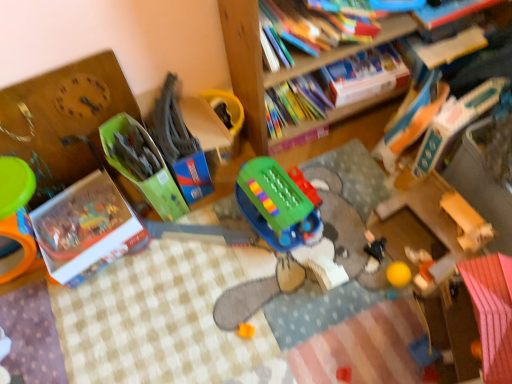
Question: Considering the relative sizes of hardcover book at upper right, which is the fourth book in left-to-right order, and hardcover book at upper right, the fourth book positioned from the right, in the image provided, is hardcover book at upper right, which is the fourth book in left-to-right order, taller than hardcover book at upper right, the fourth book positioned from the right,?

Choices:
 (A) yes
 (B) no

Answer: (B)

Question: From the image's perspective, is hardcover book at upper right, the second book when ordered from right to left, over hardcover book at upper right, the fourth book positioned from the right?

Choices:
 (A) no
 (B) yes

Answer: (B)

Question: Can you confirm if hardcover book at upper right, which is the fourth book in left-to-right order, is thinner than hardcover book at upper right, the fourth book positioned from the right?

Choices:
 (A) yes
 (B) no

Answer: (B)

Question: Is hardcover book at upper right, the second book when ordered from right to left, bigger than hardcover book at upper right, the fourth book positioned from the right?

Choices:
 (A) no
 (B) yes

Answer: (A)

Question: From a real-world perspective, is hardcover book at upper right, which is the fourth book in left-to-right order, physically below hardcover book at upper right, the fourth book positioned from the right?

Choices:
 (A) yes
 (B) no

Answer: (A)

Question: Considering the positions of green plastic toy at center, the fourth toy when ordered from left to right, and orange matte cube at center, positioned as the third toy in left-to-right order, in the image, is green plastic toy at center, the fourth toy when ordered from left to right, bigger or smaller than orange matte cube at center, positioned as the third toy in left-to-right order,?

Choices:
 (A) small
 (B) big

Answer: (B)

Question: Based on their positions, is green plastic toy at center, the fourth toy when ordered from left to right, located to the left or right of orange matte cube at center, positioned as the third toy in left-to-right order?

Choices:
 (A) left
 (B) right

Answer: (B)

Question: Considering the positions of green plastic toy at center, positioned as the third toy in right-to-left order, and orange matte cube at center, the 4th toy viewed from the right, in the image, is green plastic toy at center, positioned as the third toy in right-to-left order, taller or shorter than orange matte cube at center, the 4th toy viewed from the right,?

Choices:
 (A) tall
 (B) short

Answer: (A)

Question: In the image, is green plastic toy at center, positioned as the third toy in right-to-left order, positioned in front of or behind orange matte cube at center, the 4th toy viewed from the right?

Choices:
 (A) front
 (B) behind

Answer: (A)

Question: From their relative heights in the image, would you say wooden bookcase at upper center is taller or shorter than green plastic toy at center, the fourth toy when ordered from left to right?

Choices:
 (A) short
 (B) tall

Answer: (B)

Question: Is wooden bookcase at upper center inside the boundaries of green plastic toy at center, the fourth toy when ordered from left to right, or outside?

Choices:
 (A) outside
 (B) inside

Answer: (A)

Question: Is point (364, 130) positioned closer to the camera than point (307, 208)?

Choices:
 (A) closer
 (B) farther

Answer: (B)

Question: In terms of size, does wooden bookcase at upper center appear bigger or smaller than green plastic toy at center, the fourth toy when ordered from left to right?

Choices:
 (A) small
 (B) big

Answer: (B)

Question: Is hardcover book at upper center, which is the third book in right-to-left order, to the left or to the right of green plastic toy at center, which ranks as the 2th toy in left-to-right order, in the image?

Choices:
 (A) right
 (B) left

Answer: (A)

Question: Does point (330, 76) appear closer or farther from the camera than point (193, 153)?

Choices:
 (A) farther
 (B) closer

Answer: (A)